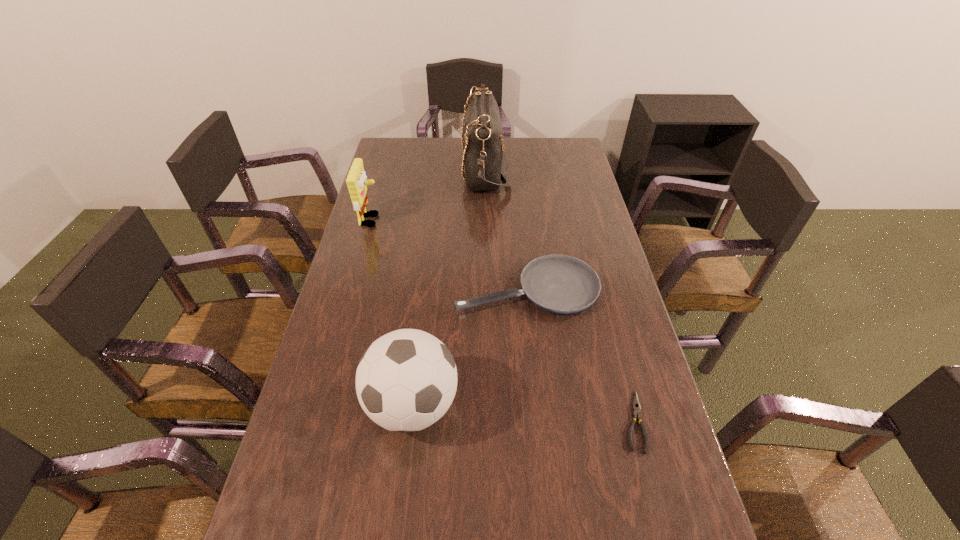
In the image, there is a desktop. At what (x,y) coordinates should I click in order to perform the action: click on vacant space at the far edge. Please return your answer as a coordinate pair (x, y). Looking at the image, I should click on (420, 162).

Where is `free region at the left edge of the desktop`? free region at the left edge of the desktop is located at coordinates (396, 204).

Locate an element on the screen. The image size is (960, 540). vacant space at the right edge is located at coordinates (635, 336).

Identify the location of free space at the far left corner of the desktop. (421, 141).

You are a GUI agent. You are given a task and a screenshot of the screen. Output one action in this format:
    pyautogui.click(x=<x>, y=<y>)
    Task: Click on the free space between the frying pan and the soccer ball
    The width and height of the screenshot is (960, 540).
    Given the screenshot: What is the action you would take?
    pyautogui.click(x=469, y=347)

Find the location of a particular element. This screenshot has height=540, width=960. vacant region between the frying pan and the handbag is located at coordinates (506, 228).

In order to click on vacant area that lies between the pliers and the leftmost object in this screenshot , I will do `click(502, 321)`.

In order to click on free spot between the leftmost object and the third farthest object in this screenshot , I will do `click(449, 254)`.

Identify the location of unoccupied area between the sponge and the shortest object. (502, 321).

Where is `vacant space that's between the fourth tallest object and the leftmost object`? The height and width of the screenshot is (540, 960). vacant space that's between the fourth tallest object and the leftmost object is located at coordinates (449, 254).